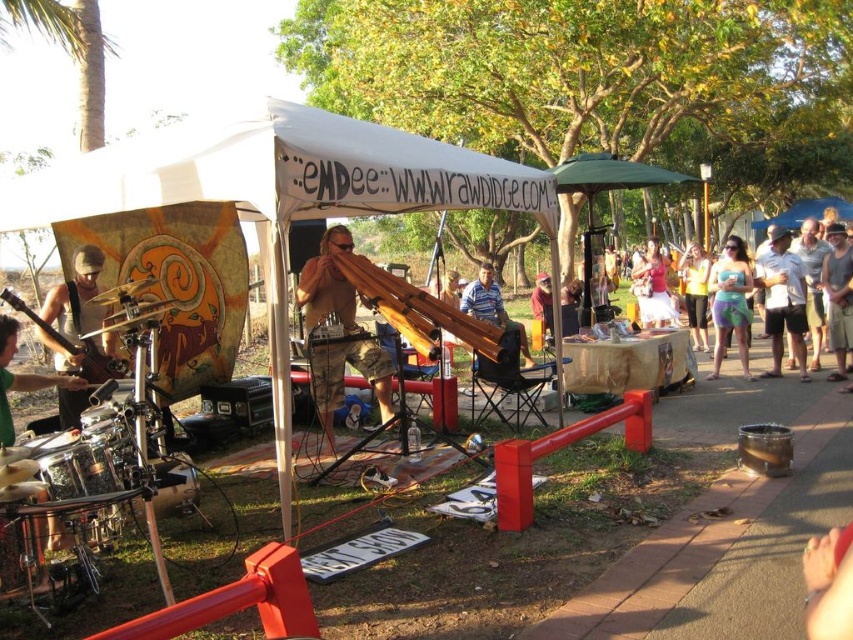
Question: Which object appears farthest from the camera in this image?

Choices:
 (A) teal fabric dress at right
 (B) white cotton shirt at right
 (C) white fabric tent at center
 (D) gray cotton tank top at right

Answer: (A)

Question: Is matte brown guitar at left to the left of green fabric drum at left from the viewer's perspective?

Choices:
 (A) yes
 (B) no

Answer: (A)

Question: Does white cotton shirt at right appear under striped polo shirt at center?

Choices:
 (A) no
 (B) yes

Answer: (B)

Question: Which is farther from the white fabric tent at center?

Choices:
 (A) matte brown guitar at left
 (B) brushed metal drum at left

Answer: (B)

Question: Where is teal fabric dress at right located in relation to white cotton skirt at center in the image?

Choices:
 (A) left
 (B) right

Answer: (B)

Question: Which of these objects is positioned farthest from the green fabric drum at left?

Choices:
 (A) white cotton skirt at center
 (B) brushed metal drum at left
 (C) blue denim shorts at center
 (D) white fabric tent at center

Answer: (C)